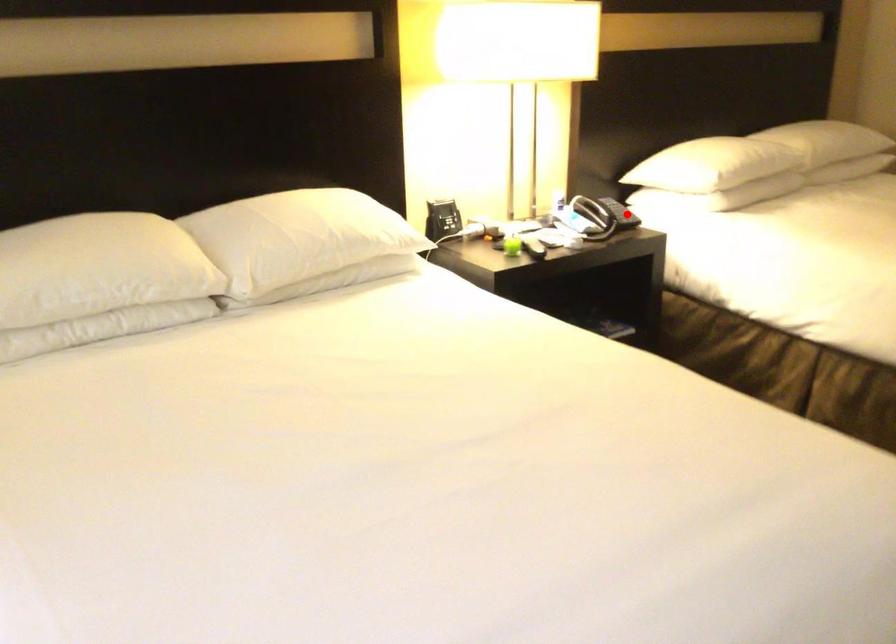
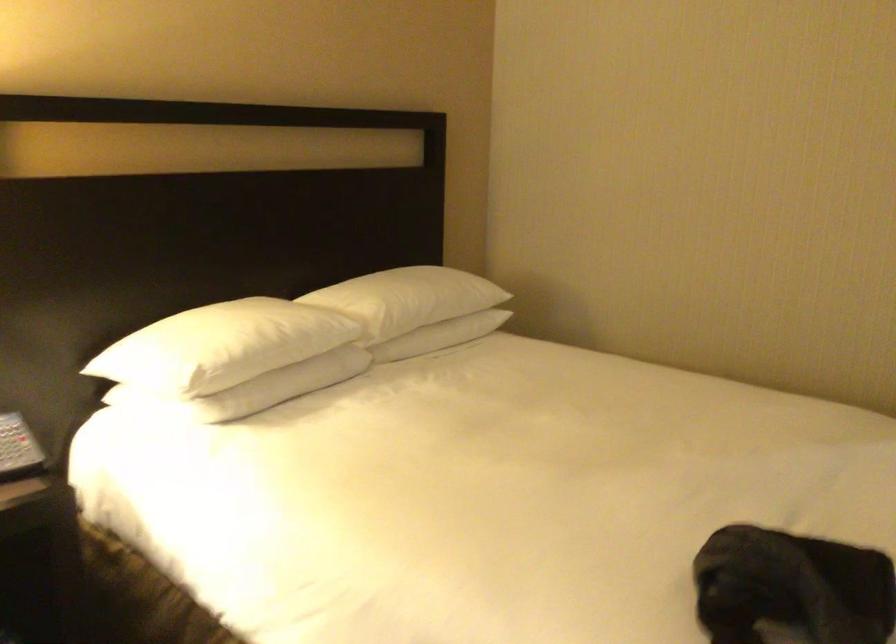
Question: I am providing you with two images of the same scene from different viewpoints. Image1 has a red point marked. In image2, the corresponding 3D location appears at what relative position? Reply with the corresponding letter.

Choices:
 (A) Closer
 (B) Farther

Answer: (A)